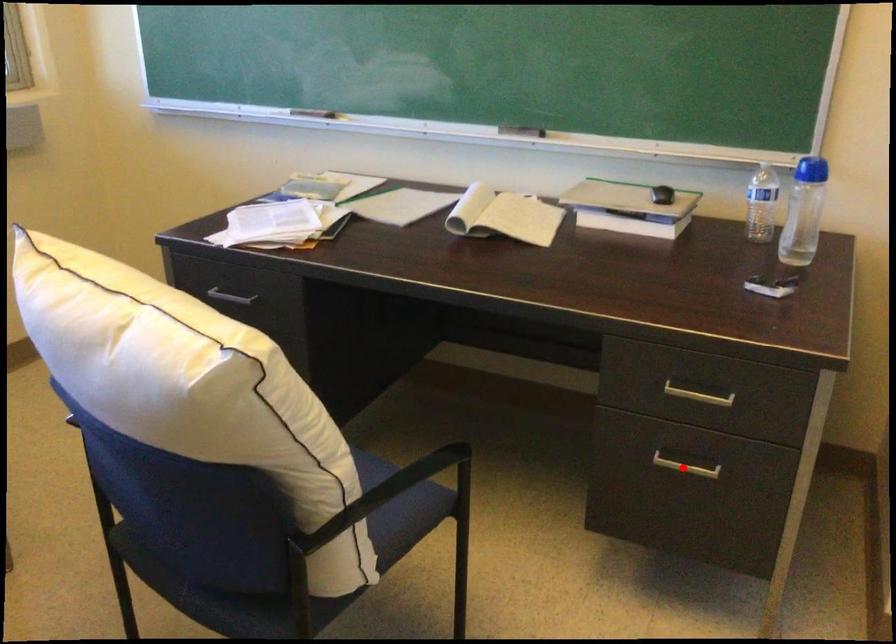
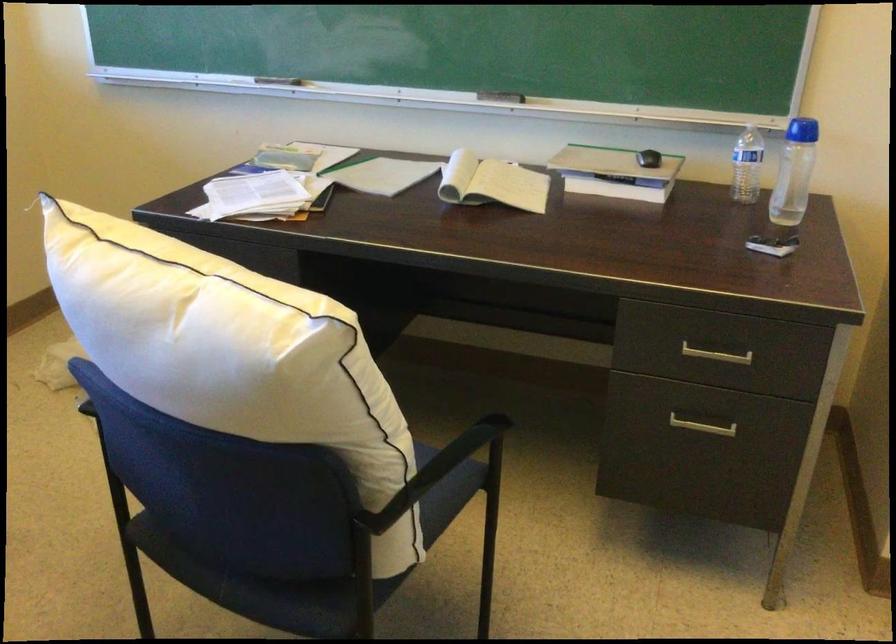
In the second image, find the point that corresponds to the highlighted location in the first image.

(702, 426)